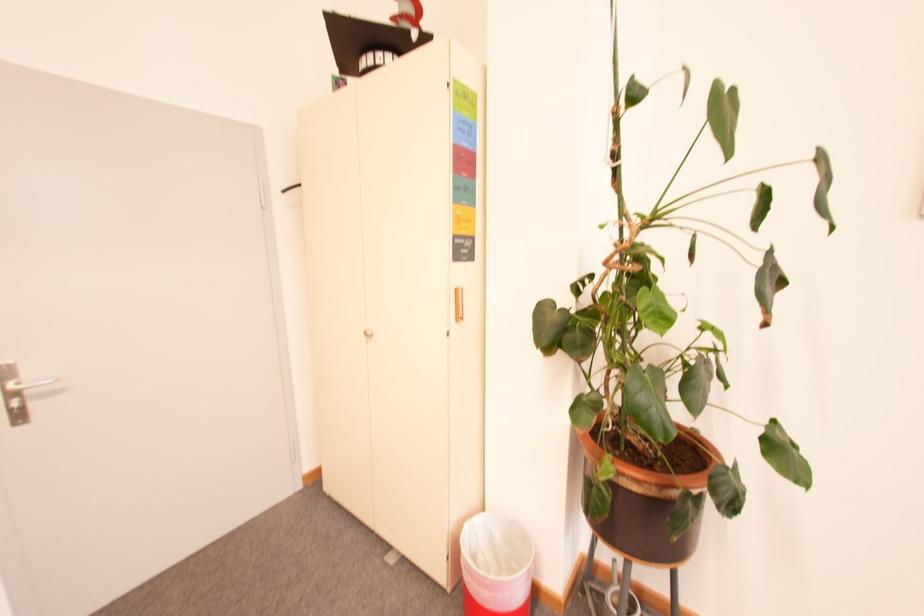
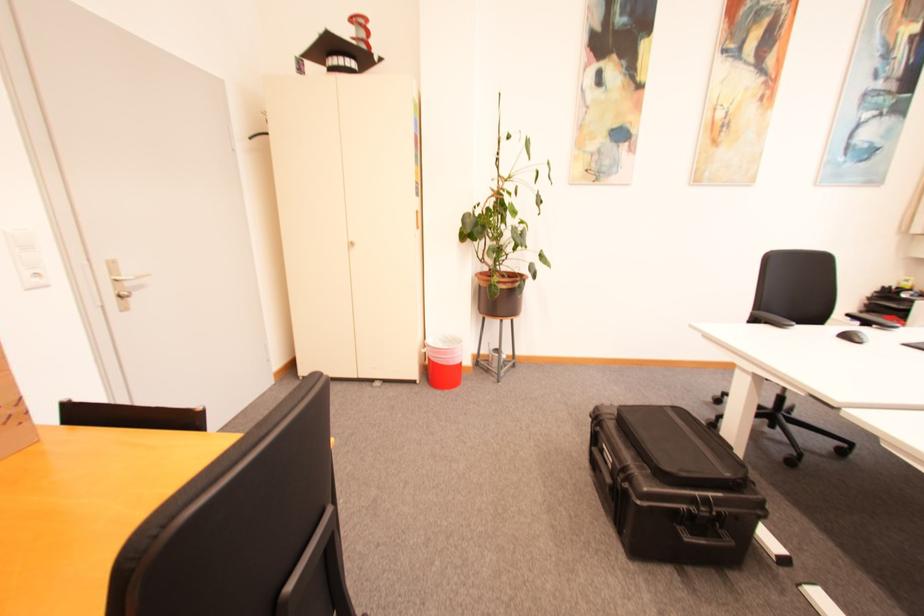
Where in the second image is the point corresponding to [35,392] from the first image?

(134, 285)